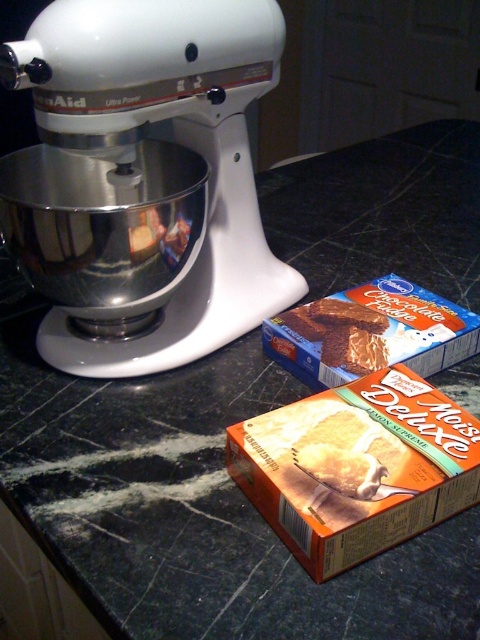
Question: Is white glossy stand mixer at left behind blue cardboard box at center?

Choices:
 (A) no
 (B) yes

Answer: (A)

Question: Among these points, which one is nearest to the camera?

Choices:
 (A) (342, 381)
 (B) (416, 477)

Answer: (B)

Question: Which object appears closest to the camera in this image?

Choices:
 (A) orange cardboard cake mix box at lower right
 (B) blue cardboard box at center
 (C) white glossy stand mixer at left

Answer: (A)

Question: Is orange cardboard cake mix box at lower right above blue cardboard box at center?

Choices:
 (A) no
 (B) yes

Answer: (A)

Question: Which point is farther to the camera?

Choices:
 (A) blue cardboard box at center
 (B) orange cardboard cake mix box at lower right

Answer: (A)

Question: Can you confirm if orange cardboard cake mix box at lower right is wider than blue cardboard box at center?

Choices:
 (A) yes
 (B) no

Answer: (B)